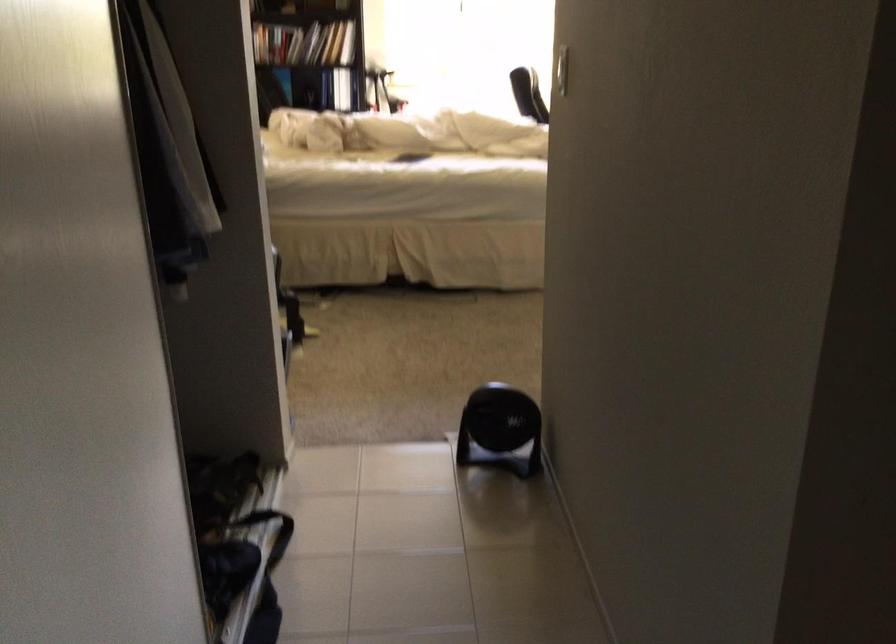
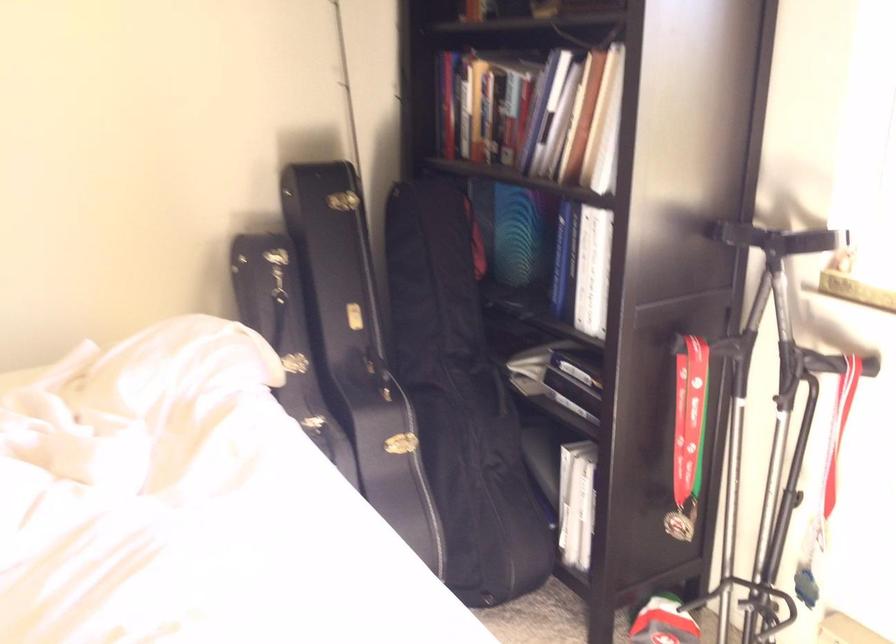
The point at (409, 102) is marked in the first image. Where is the corresponding point in the second image?

(764, 413)